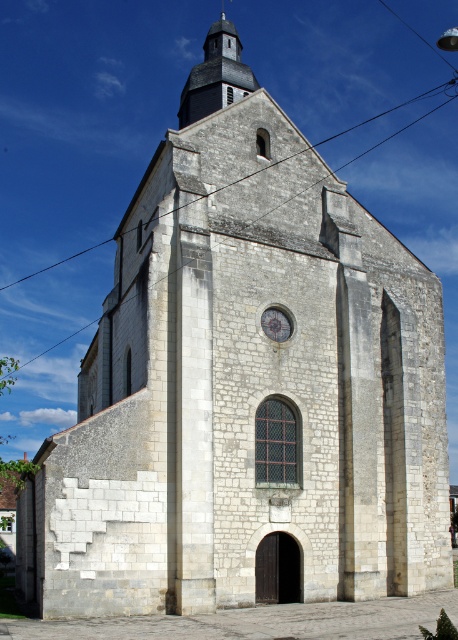
Question: Considering the relative positions of smooth gray spire at upper center and matte gray clock at center in the image provided, where is smooth gray spire at upper center located with respect to matte gray clock at center?

Choices:
 (A) above
 (B) below

Answer: (A)

Question: Does smooth gray spire at upper center have a lesser width compared to matte gray clock at center?

Choices:
 (A) yes
 (B) no

Answer: (B)

Question: Which point is farther to the camera?

Choices:
 (A) (181, 108)
 (B) (270, 336)

Answer: (A)

Question: Can you confirm if smooth gray spire at upper center is wider than matte gray clock at center?

Choices:
 (A) yes
 (B) no

Answer: (A)